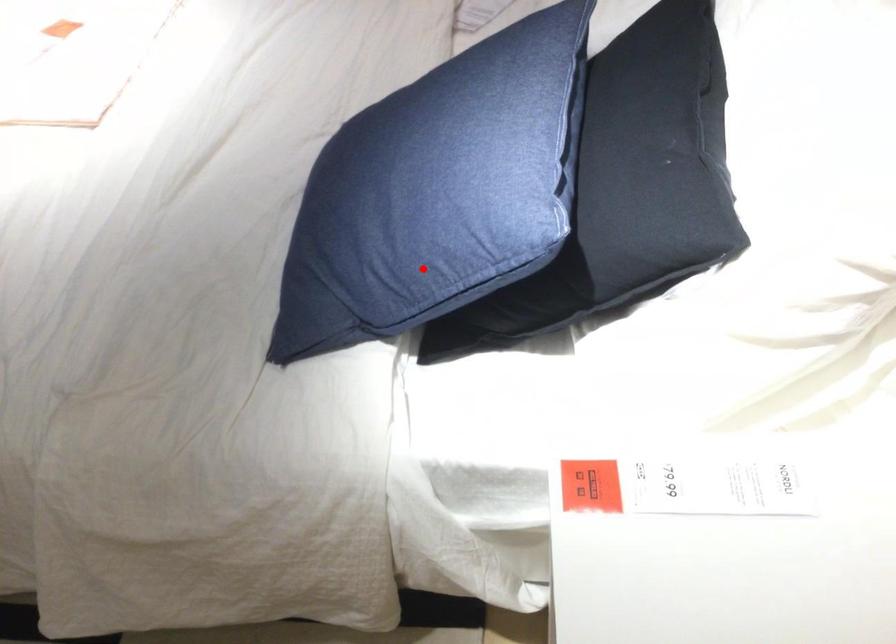
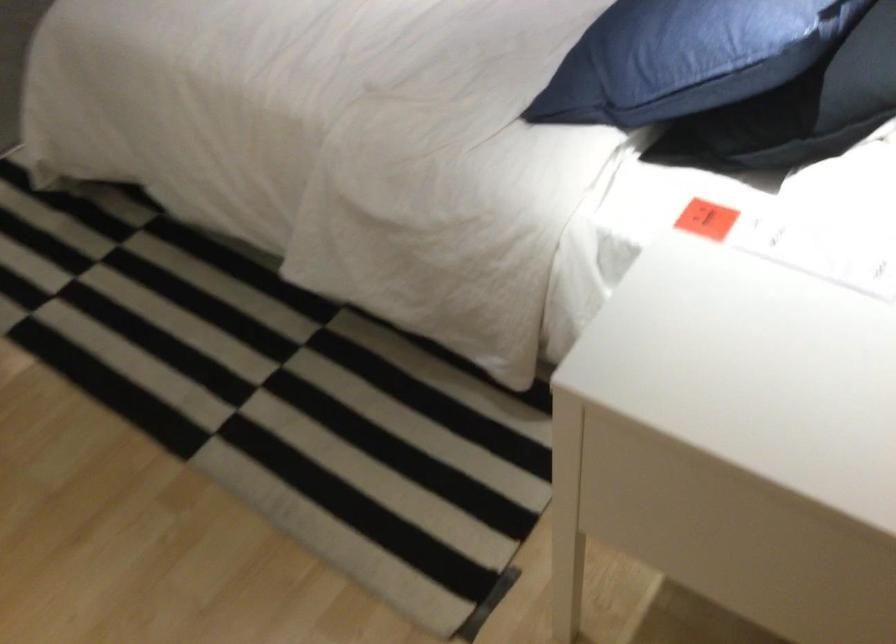
Question: I am providing you with two images of the same scene from different viewpoints. Image1 has a red point marked. In image2, the corresponding 3D location appears at what relative position? Reply with the corresponding letter.

Choices:
 (A) Closer
 (B) Farther

Answer: (B)